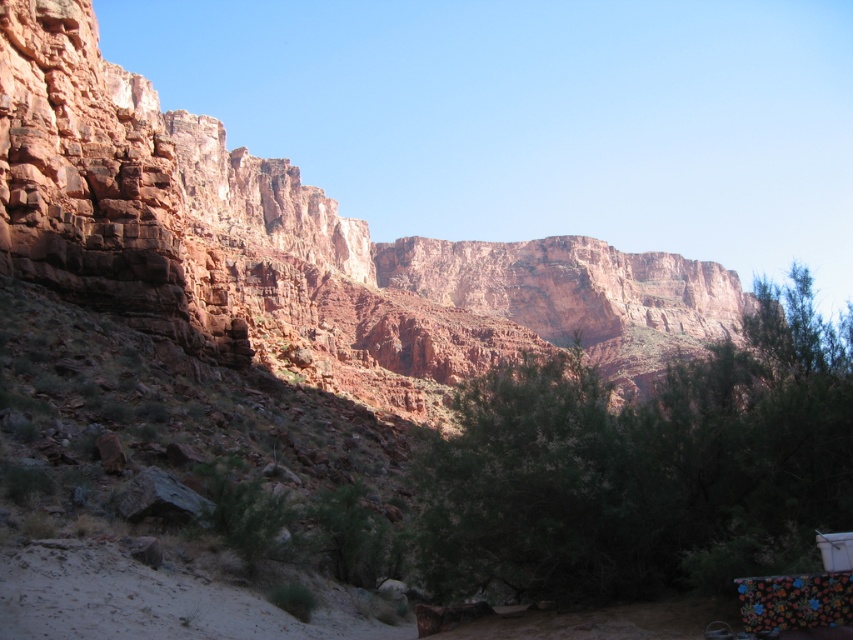
Question: Can you confirm if rustic rock formation at upper left is positioned below green leafy tree at center?

Choices:
 (A) yes
 (B) no

Answer: (B)

Question: Can you confirm if rustic rock formation at upper left is smaller than green leafy tree at center?

Choices:
 (A) yes
 (B) no

Answer: (B)

Question: Can you confirm if rustic rock formation at upper left is wider than green leafy tree at center?

Choices:
 (A) yes
 (B) no

Answer: (A)

Question: Which point is farther from the camera taking this photo?

Choices:
 (A) (231, 257)
 (B) (474, 515)

Answer: (A)

Question: Which point is closer to the camera?

Choices:
 (A) (195, 170)
 (B) (724, 544)

Answer: (B)